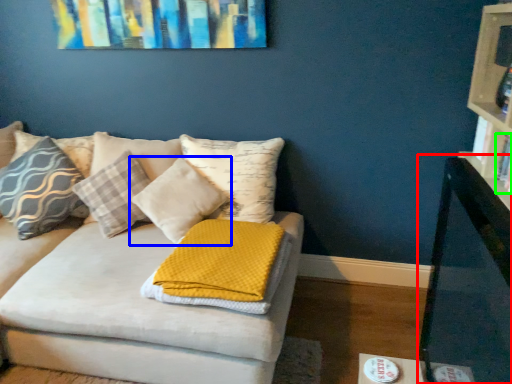
Question: Based on their relative distances, which object is nearer to table (highlighted by a red box)? Choose from pillow (highlighted by a blue box) and book (highlighted by a green box).

Choices:
 (A) pillow
 (B) book

Answer: (B)